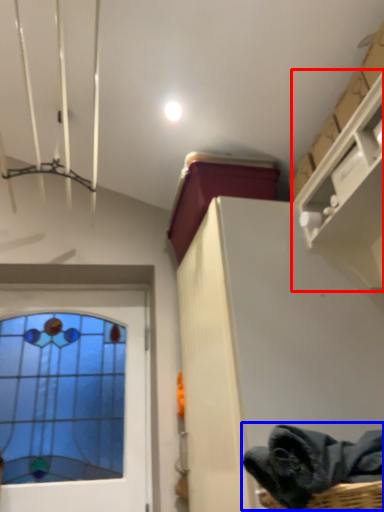
Question: Which point is closer to the camera, shelf (highlighted by a red box) or clothing (highlighted by a blue box)?

Choices:
 (A) shelf
 (B) clothing

Answer: (B)